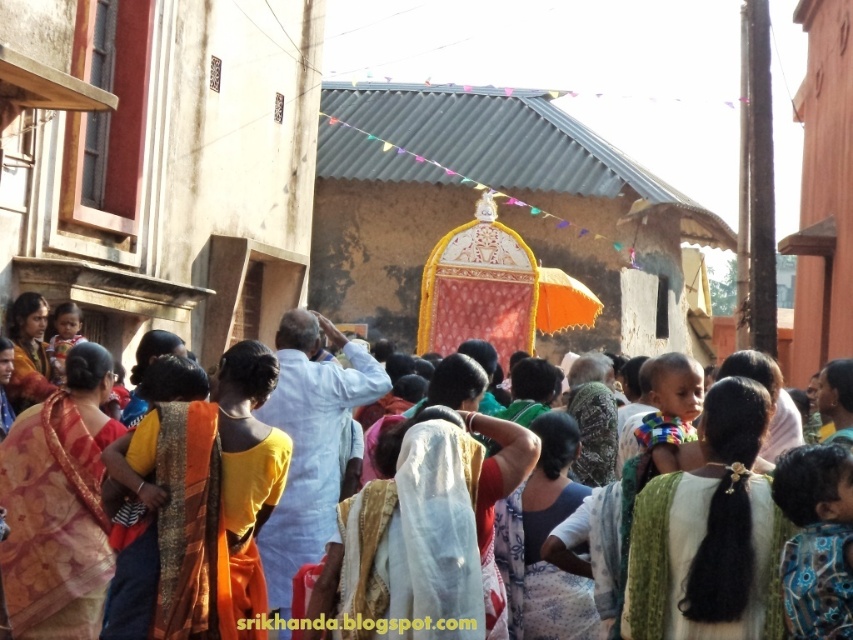
Question: Can you confirm if white sheer saree at center is positioned below matte orange saree at left?

Choices:
 (A) yes
 (B) no

Answer: (A)

Question: Is silk saree at center to the right of white sheer saree at center from the viewer's perspective?

Choices:
 (A) no
 (B) yes

Answer: (A)

Question: Estimate the real-world distances between objects in this image. Which object is closer to the yellow fabric at center?

Choices:
 (A) white sheer saree at center
 (B) silk saree at center
 (C) blue fabric saree at center
 (D) matte orange saree at left

Answer: (A)

Question: Which object is positioned farthest from the blue fabric saree at center?

Choices:
 (A) matte orange cloth at center
 (B) white sheer saree at center
 (C) yellow fabric at center

Answer: (C)

Question: In this image, where is multicolored fabric at center located relative to white sheer saree at center?

Choices:
 (A) left
 (B) right

Answer: (B)

Question: Which object appears closest to the camera in this image?

Choices:
 (A) white sheer saree at center
 (B) blue fabric saree at center
 (C) matte orange saree at left
 (D) multicolored fabric at center

Answer: (D)